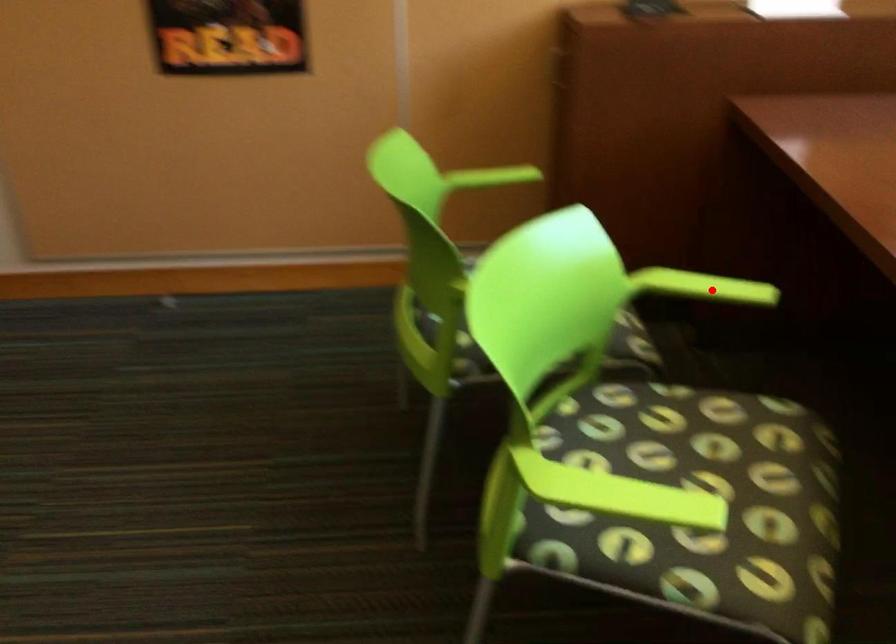
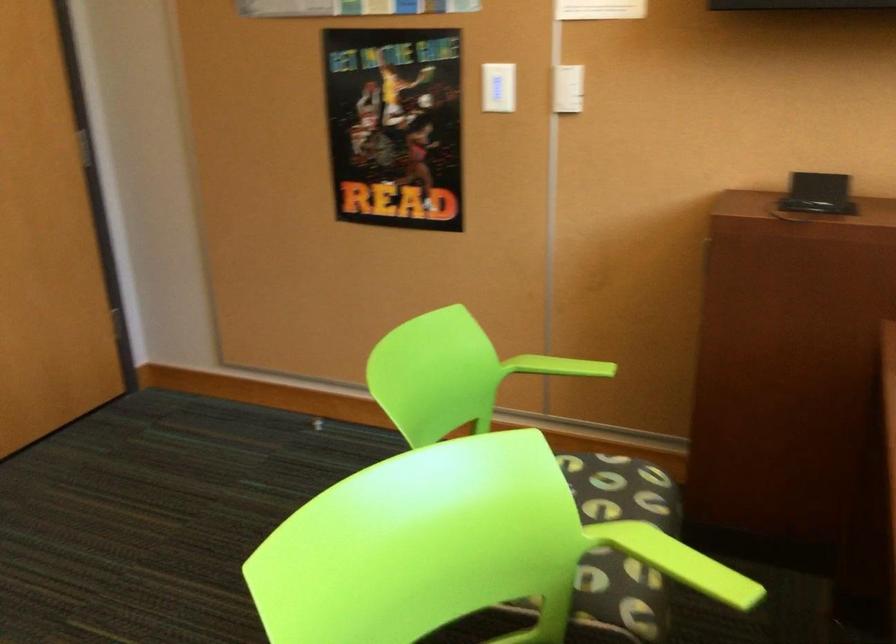
Question: I am providing you with two images of the same scene from different viewpoints. A red point is shown in image1. For the corresponding object point in image2, is it positioned nearer or farther from the camera?

Choices:
 (A) Nearer
 (B) Farther

Answer: (A)